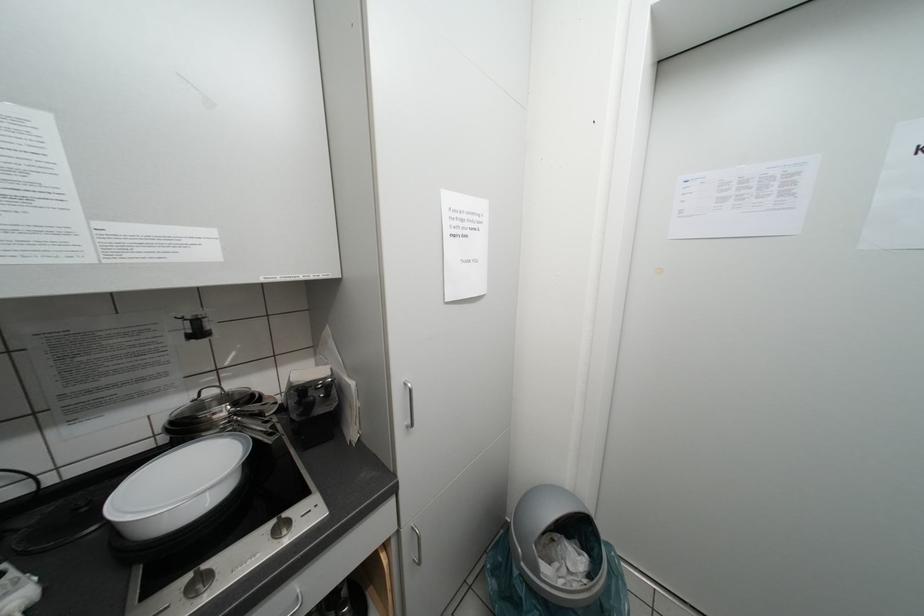
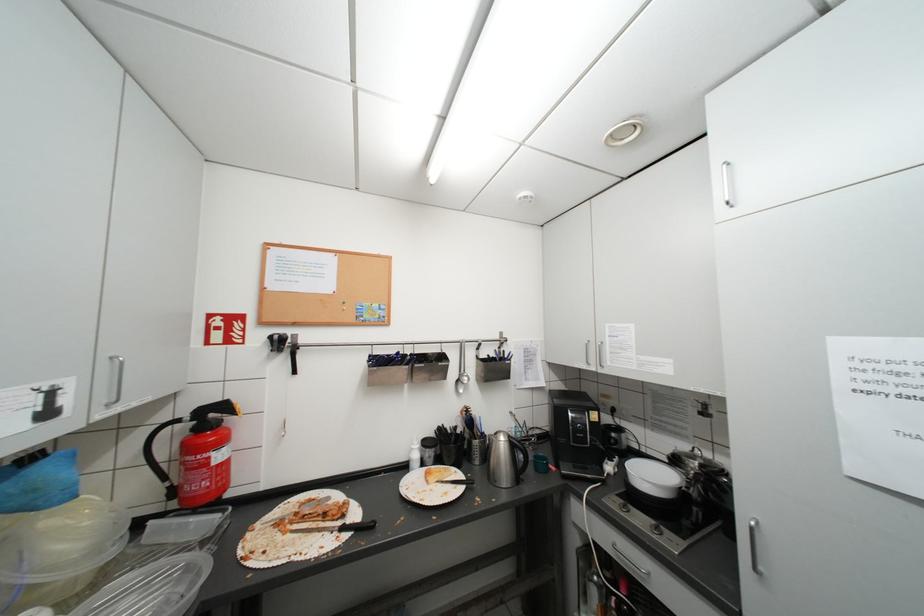
Question: The images are taken continuously from a first-person perspective. In which direction is your viewpoint rotating?

Choices:
 (A) Left
 (B) Right
 (C) Up
 (D) Down

Answer: (A)